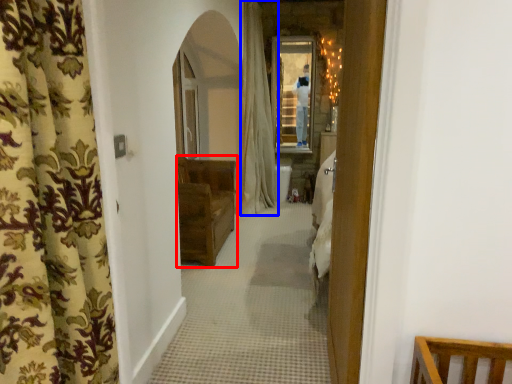
Question: Which object is closer to the camera taking this photo, furniture (highlighted by a red box) or curtain (highlighted by a blue box)?

Choices:
 (A) furniture
 (B) curtain

Answer: (A)